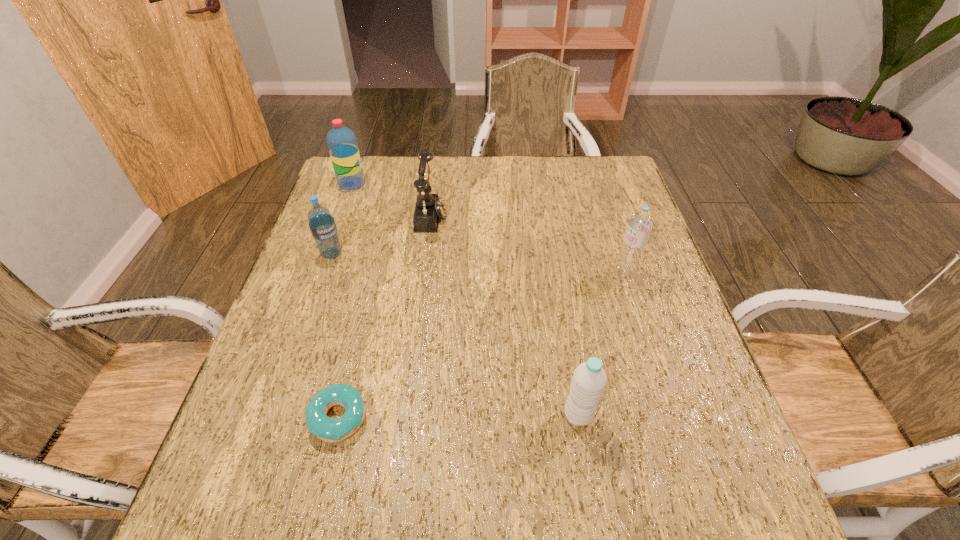
In order to click on the farthest water bottle in this screenshot , I will do `click(342, 144)`.

The width and height of the screenshot is (960, 540). What are the coordinates of `the third nearest object` in the screenshot? It's located at (640, 223).

Locate an element on the screen. The width and height of the screenshot is (960, 540). the rightmost water bottle is located at coordinates (640, 223).

Locate an element on the screen. The image size is (960, 540). telephone is located at coordinates (429, 208).

I want to click on the fifth nearest object, so click(x=429, y=208).

You are a GUI agent. You are given a task and a screenshot of the screen. Output one action in this format:
    pyautogui.click(x=<x>, y=<y>)
    Task: Click on the fourth nearest object
    
    Given the screenshot: What is the action you would take?
    pyautogui.click(x=322, y=225)

You are a GUI agent. You are given a task and a screenshot of the screen. Output one action in this format:
    pyautogui.click(x=<x>, y=<y>)
    Task: Click on the second object from right to left
    This screenshot has width=960, height=540.
    Given the screenshot: What is the action you would take?
    589,380

At what (x,y) coordinates should I click in order to perform the action: click on the nearest water bottle. Please return your answer as a coordinate pair (x, y). Looking at the image, I should click on (589, 380).

Locate an element on the screen. This screenshot has width=960, height=540. the shortest object is located at coordinates (328, 429).

The width and height of the screenshot is (960, 540). Identify the location of doughnut. (328, 429).